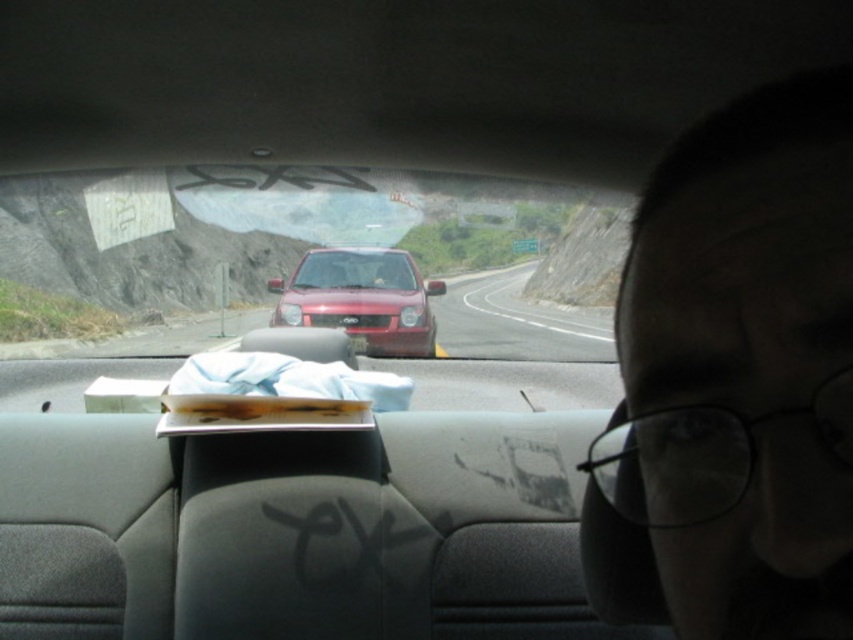
Consider the image. You are driving a car and see the point at coordinates (683, 579) in front of you. If your car is 4.5 feet wide, can you safely change lanes to the left without hitting the red car ahead?

The point at coordinates (683, 579) is 3.52 feet away from the viewer. Since the car is 4.5 feet wide, changing lanes to the left may not be safe as the distance is less than the car width. Wait for a safer opportunity.

You are driving and see a brown leather wallet at center and a smooth asphalt road at center ahead. To avoid hitting the wallet, should you steer left or right?

The smooth asphalt road at center is to the right of the brown leather wallet at center, so to avoid hitting the wallet, you should steer left to move towards the road.

You are driving a car and see two points ahead on the road. The first point is at coordinate point(750,188) and the second point is at coordinate point(579,308). Which point is closer to your current position?

Point(750,188) is in front of point(579,308), so the first point is closer to your current position.